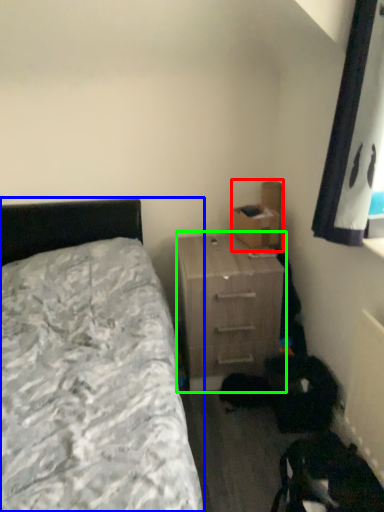
Question: Which is farther away from cardboard box (highlighted by a red box)? bed (highlighted by a blue box) or nightstand (highlighted by a green box)?

Choices:
 (A) bed
 (B) nightstand

Answer: (A)